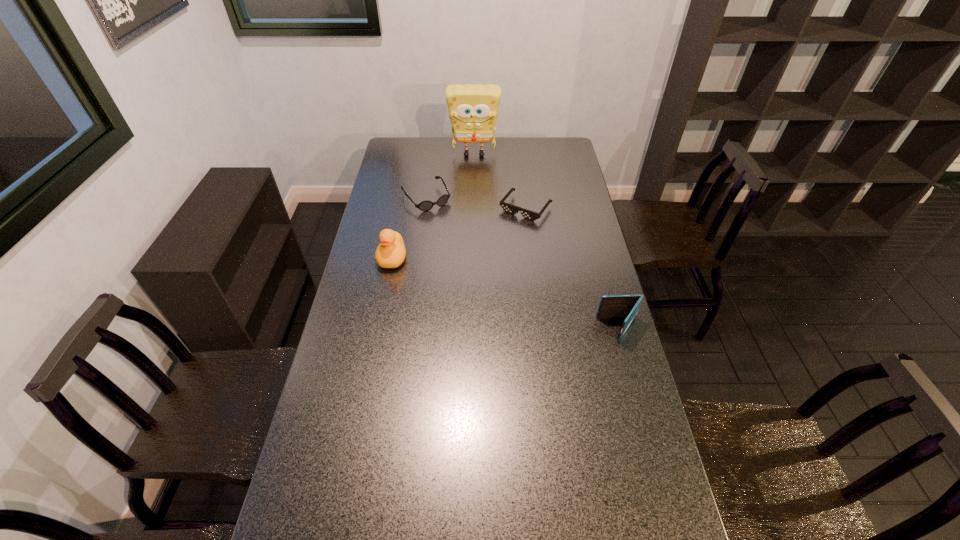
This screenshot has width=960, height=540. Identify the location of the fourth farthest object. (391, 252).

Where is `duck`? duck is located at coordinates (391, 252).

Where is `wallet`? The image size is (960, 540). wallet is located at coordinates (617, 306).

The image size is (960, 540). In order to click on the nearest object in this screenshot , I will do 617,306.

The image size is (960, 540). I want to click on the left sunglasses, so click(426, 205).

Identify the location of the taller sunglasses. The width and height of the screenshot is (960, 540). pyautogui.click(x=426, y=205).

Locate an element on the screen. This screenshot has width=960, height=540. the tallest object is located at coordinates (473, 109).

The width and height of the screenshot is (960, 540). Identify the location of sponge. (473, 109).

You are a GUI agent. You are given a task and a screenshot of the screen. Output one action in this format:
    pyautogui.click(x=<x>, y=<y>)
    Task: Click on the right sunglasses
    This screenshot has height=540, width=960.
    Given the screenshot: What is the action you would take?
    pyautogui.click(x=509, y=208)

Locate an element on the screen. Image resolution: width=960 pixels, height=540 pixels. the shortest object is located at coordinates (509, 208).